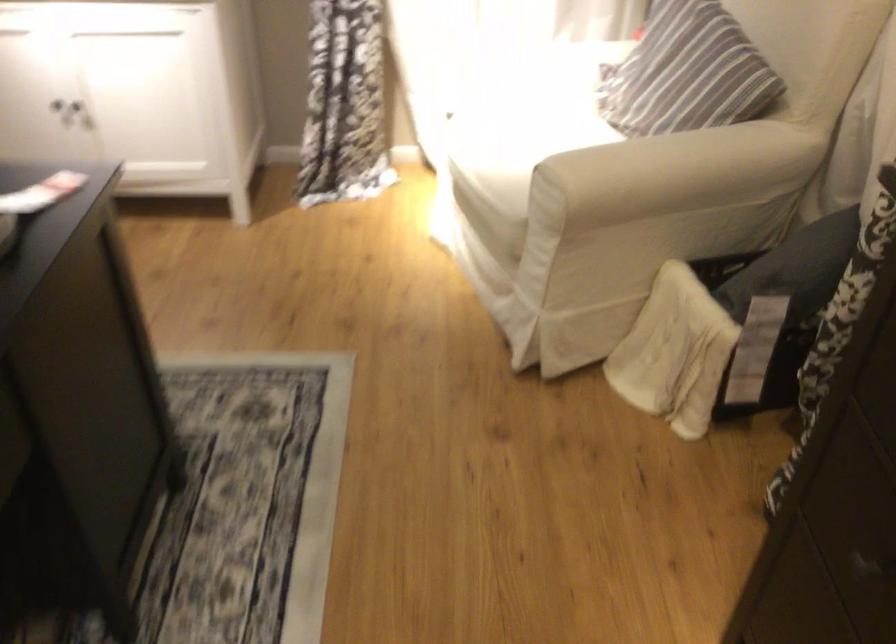
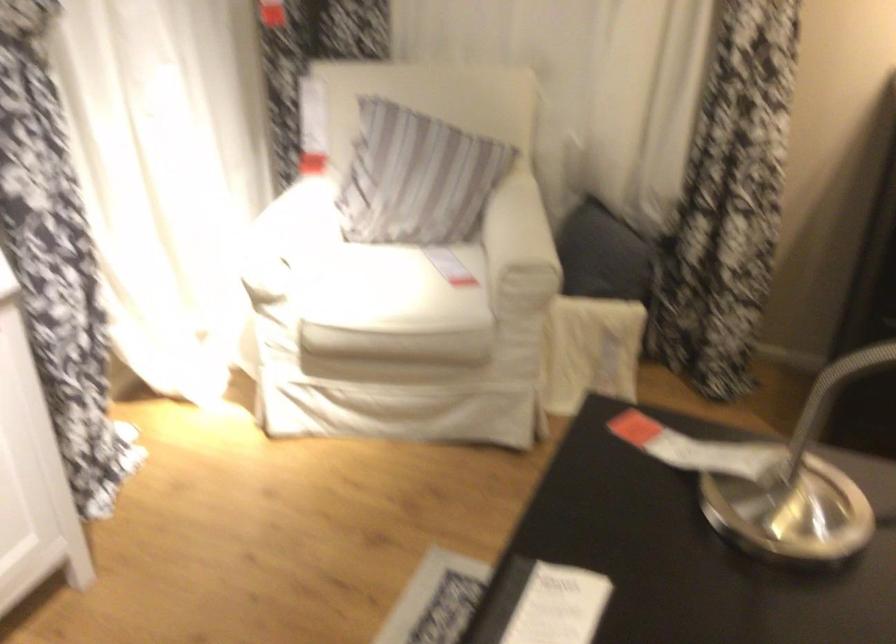
Where in the second image is the point corresponding to point 762,254 from the first image?

(604, 254)